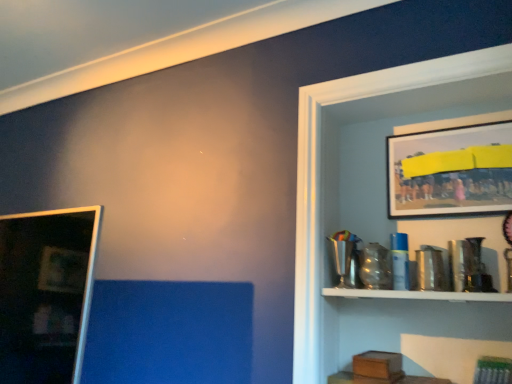
Image resolution: width=512 pixels, height=384 pixels. What are the coordinates of `free space above matte black picture frame at left, which ranks as the second picture frame in top-to-bottom order (from a real-world perspective)` in the screenshot? It's located at (35, 213).